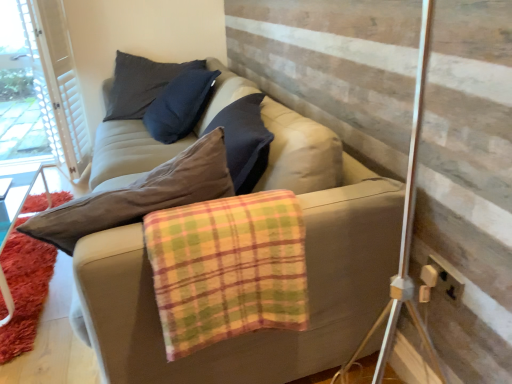
Question: From a real-world perspective, is beige fabric couch at center positioned over white textured barn door at upper left based on gravity?

Choices:
 (A) yes
 (B) no

Answer: (B)

Question: Could you tell me if beige fabric couch at center is turned towards white textured barn door at upper left?

Choices:
 (A) no
 (B) yes

Answer: (B)

Question: Considering the relative sizes of beige fabric couch at center and white textured barn door at upper left in the image provided, is beige fabric couch at center shorter than white textured barn door at upper left?

Choices:
 (A) no
 (B) yes

Answer: (B)

Question: Is beige fabric couch at center thinner than white textured barn door at upper left?

Choices:
 (A) no
 (B) yes

Answer: (A)

Question: Does beige fabric couch at center come in front of white textured barn door at upper left?

Choices:
 (A) no
 (B) yes

Answer: (B)

Question: Is beige fabric couch at center located outside white textured barn door at upper left?

Choices:
 (A) no
 (B) yes

Answer: (B)

Question: Is beige fabric couch at center far away from beige plastic socket at lower right?

Choices:
 (A) yes
 (B) no

Answer: (B)

Question: Is beige fabric couch at center looking in the opposite direction of beige plastic socket at lower right?

Choices:
 (A) yes
 (B) no

Answer: (B)

Question: From the image's perspective, does beige fabric couch at center appear lower than beige plastic socket at lower right?

Choices:
 (A) no
 (B) yes

Answer: (A)

Question: Is beige fabric couch at center closer to the viewer compared to beige plastic socket at lower right?

Choices:
 (A) yes
 (B) no

Answer: (A)

Question: From a real-world perspective, is beige fabric couch at center located beneath beige plastic socket at lower right?

Choices:
 (A) yes
 (B) no

Answer: (B)

Question: From a real-world perspective, is beige fabric couch at center located higher than beige plastic socket at lower right?

Choices:
 (A) yes
 (B) no

Answer: (A)

Question: From the image's perspective, is white textured barn door at upper left over beige plastic socket at lower right?

Choices:
 (A) no
 (B) yes

Answer: (B)